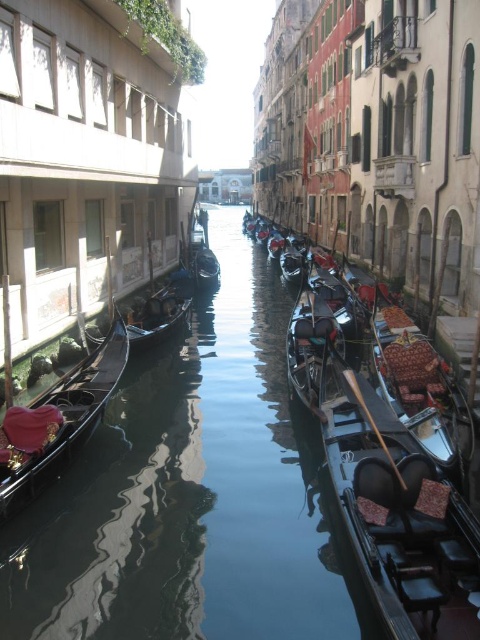
You are standing at the point with coordinates (204,253) in the canal scene. What object would you find there?

At point (204,253) lies shiny black gondola at center.

You are a tourist standing on the bridge overlooking the canal. You see two shiny black gondola at left and shiny black gondola at center. Which gondola is closer to the modern buildings on the left side of the canal?

The shiny black gondola at left is positioned on the left side of the shiny black gondola at center, so it is closer to the modern buildings on the left side of the canal.

You are standing at the point of reference in the scene. Where is the polished wood gondola at center located in relation to your position?

The polished wood gondola at center is located at the coordinates point of reference at point (420, 385).